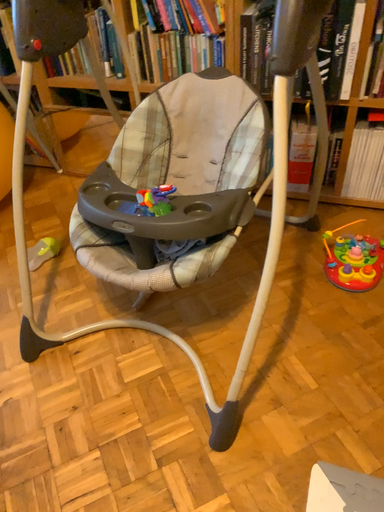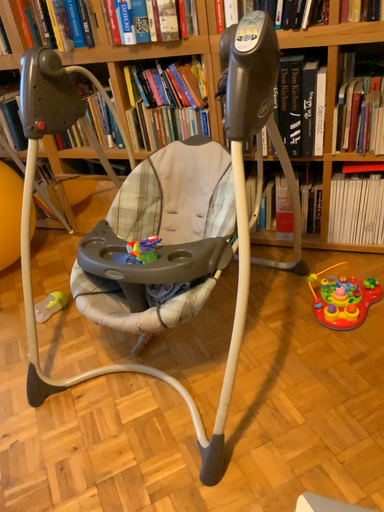
Question: Which way did the camera rotate in the video?

Choices:
 (A) rotated upward
 (B) rotated downward

Answer: (A)